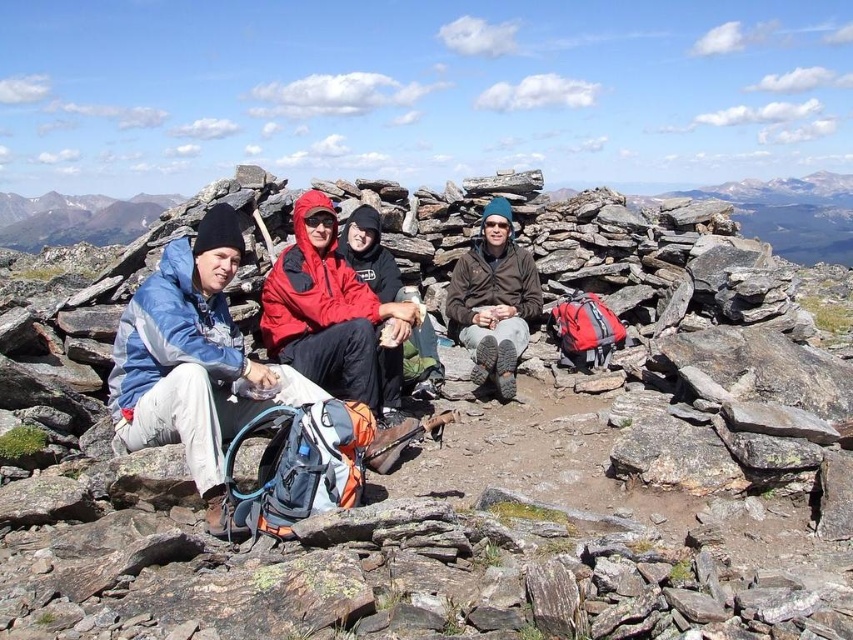
Question: Which point is farther from the camera taking this photo?

Choices:
 (A) (305, 208)
 (B) (488, 285)

Answer: (B)

Question: Is red nylon jacket at center thinner than brown matte jacket at center?

Choices:
 (A) yes
 (B) no

Answer: (B)

Question: Which point is farther to the camera?

Choices:
 (A) rusty metal rock at center
 (B) brown matte jacket at center

Answer: (B)

Question: Which of the following is the farthest from the observer?

Choices:
 (A) red nylon jacket at center
 (B) brown matte jacket at center
 (C) rusty metal rock at center

Answer: (B)

Question: Can you confirm if rusty metal rock at center is smaller than brown matte jacket at center?

Choices:
 (A) yes
 (B) no

Answer: (B)

Question: Can you confirm if rusty metal rock at center is positioned above red nylon jacket at center?

Choices:
 (A) yes
 (B) no

Answer: (B)